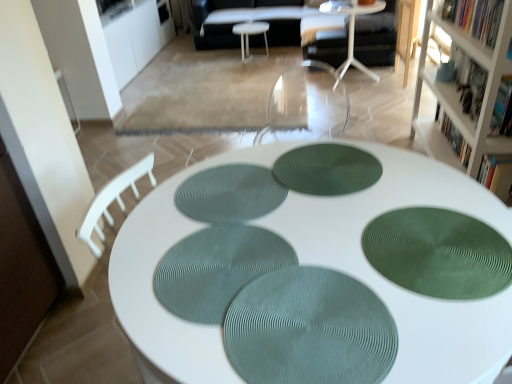
Image resolution: width=512 pixels, height=384 pixels. I want to click on free space between green textured placemat at center, which is the first mat from left to right, and green textured mat at lower right, marked as the first mat in a right-to-left arrangement, so click(x=324, y=223).